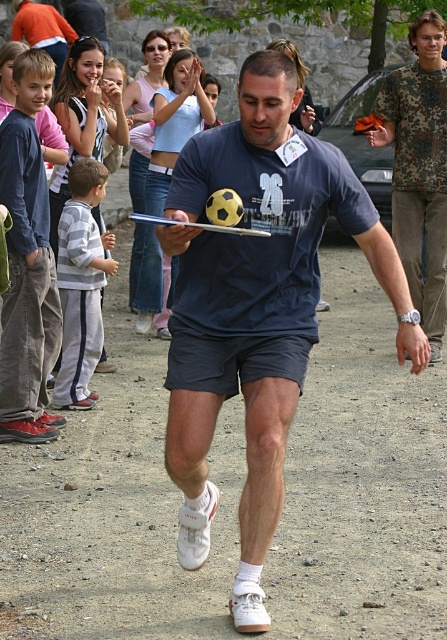
You are an event organizer trying to set up a photo booth. The camouflage fabric shirt at right is part of the backdrop. Where exactly should you place the backdrop based on the coordinates provided?

The camouflage fabric shirt at right should be placed at the coordinates point (420, 170) as specified in the description.